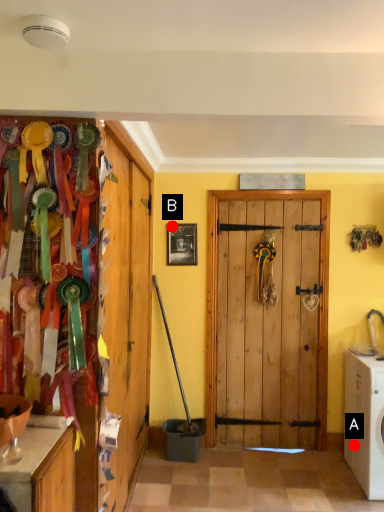
Question: Two points are circled on the image, labeled by A and B beside each circle. Which point is further to the camera?

Choices:
 (A) A is further
 (B) B is further

Answer: (B)